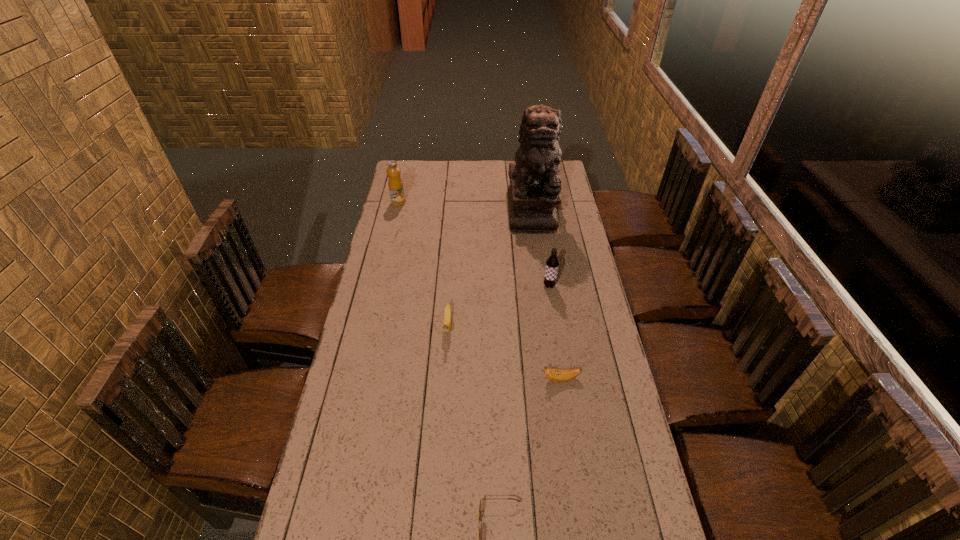
Where is `unoccupied area between the third tallest object and the second nearest object`? unoccupied area between the third tallest object and the second nearest object is located at coordinates click(x=555, y=333).

At what (x,y) coordinates should I click in order to perform the action: click on free space between the farther banana and the leftmost object. Please return your answer as a coordinate pair (x, y). The height and width of the screenshot is (540, 960). Looking at the image, I should click on pyautogui.click(x=422, y=264).

At what (x,y) coordinates should I click in order to perform the action: click on free point between the tallest object and the second nearest object. Please return your answer as a coordinate pair (x, y). Looking at the image, I should click on (546, 294).

Identify which object is located as the second nearest to the tallest object. Please provide its 2D coordinates. Your answer should be formatted as a tuple, i.e. [(x, y)], where the tuple contains the x and y coordinates of a point satisfying the conditions above.

[(395, 184)]

Where is `object that stands as the fifth closest to the third nearest object`? object that stands as the fifth closest to the third nearest object is located at coordinates (395, 184).

Locate an element on the screen. The width and height of the screenshot is (960, 540). free point that satisfies the following two spatial constraints: 1. on the front label of the leftmost object; 2. on the right side of the fourth nearest object is located at coordinates (379, 286).

This screenshot has height=540, width=960. Identify the location of vacant space that satisfies the following two spatial constraints: 1. on the back side of the root beer; 2. on the front label of the fruit juice. (536, 202).

This screenshot has width=960, height=540. What are the coordinates of `vacant space that satisfies the following two spatial constraints: 1. on the front-facing side of the fifth farthest object; 2. on the right side of the tallest object` in the screenshot? It's located at (556, 379).

Find the location of a particular element. The image size is (960, 540). free region that satisfies the following two spatial constraints: 1. at the stem of the farther banana; 2. on the left side of the second nearest object is located at coordinates (444, 379).

At what (x,y) coordinates should I click in order to perform the action: click on vacant point that satisfies the following two spatial constraints: 1. at the stem of the nearer banana; 2. on the right side of the farther banana. Please return your answer as a coordinate pair (x, y). Looking at the image, I should click on (444, 379).